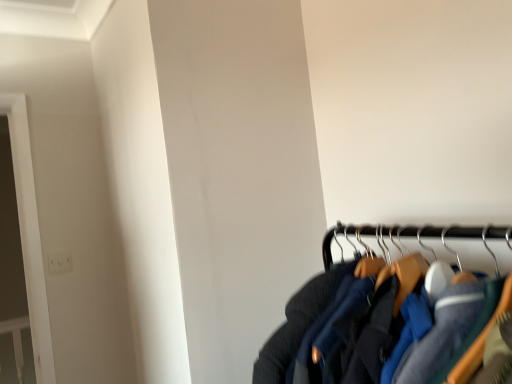
This screenshot has width=512, height=384. What do you see at coordinates (60, 262) in the screenshot?
I see `white plastic electric outlet at upper left` at bounding box center [60, 262].

I want to click on white plastic electric outlet at upper left, so click(60, 262).

What is the approximate width of dark blue fabric jacket at lower right?

It is 26.81 inches.

Locate an element on the screen. dark blue fabric jacket at lower right is located at coordinates (300, 313).

The image size is (512, 384). Describe the element at coordinates (300, 313) in the screenshot. I see `dark blue fabric jacket at lower right` at that location.

At what (x,y) coordinates should I click in order to perform the action: click on white plastic electric outlet at upper left. Please return your answer as a coordinate pair (x, y). The width and height of the screenshot is (512, 384). Looking at the image, I should click on (60, 262).

Can you confirm if dark blue fabric jacket at lower right is positioned to the left of white plastic electric outlet at upper left?

No, dark blue fabric jacket at lower right is not to the left of white plastic electric outlet at upper left.

In the image, is dark blue fabric jacket at lower right positioned in front of or behind white plastic electric outlet at upper left?

Visually, dark blue fabric jacket at lower right is located in front of white plastic electric outlet at upper left.

Is point (312, 314) more distant than point (49, 253)?

No.

Consider the image. From the image's perspective, is dark blue fabric jacket at lower right on white plastic electric outlet at upper left?

Yes, from the image's perspective, dark blue fabric jacket at lower right is over white plastic electric outlet at upper left.

From a real-world perspective, relative to white plastic electric outlet at upper left, is dark blue fabric jacket at lower right vertically above or below?

From a real-world perspective, dark blue fabric jacket at lower right is physically below white plastic electric outlet at upper left.

Considering the sizes of objects dark blue fabric jacket at lower right and white plastic electric outlet at upper left in the image provided, who is wider, dark blue fabric jacket at lower right or white plastic electric outlet at upper left?

dark blue fabric jacket at lower right is wider.

In terms of height, does dark blue fabric jacket at lower right look taller or shorter compared to white plastic electric outlet at upper left?

dark blue fabric jacket at lower right is taller than white plastic electric outlet at upper left.

Consider the image. Is dark blue fabric jacket at lower right bigger than white plastic electric outlet at upper left?

Yes, dark blue fabric jacket at lower right is bigger than white plastic electric outlet at upper left.

Is dark blue fabric jacket at lower right positioned beyond the bounds of white plastic electric outlet at upper left?

That's correct, dark blue fabric jacket at lower right is outside of white plastic electric outlet at upper left.

Would you consider dark blue fabric jacket at lower right to be distant from white plastic electric outlet at upper left?

Yes, dark blue fabric jacket at lower right is far from white plastic electric outlet at upper left.

Is dark blue fabric jacket at lower right looking in the opposite direction of white plastic electric outlet at upper left?

No, dark blue fabric jacket at lower right's orientation is not away from white plastic electric outlet at upper left.

This screenshot has width=512, height=384. Find the location of `electric outlet lying behind the dark blue fabric jacket at lower right`. electric outlet lying behind the dark blue fabric jacket at lower right is located at coordinates pyautogui.click(x=60, y=262).

In the scene shown: Considering the relative positions of white plastic electric outlet at upper left and dark blue fabric jacket at lower right in the image provided, is white plastic electric outlet at upper left to the right of dark blue fabric jacket at lower right from the viewer's perspective?

No.

From the picture: Is white plastic electric outlet at upper left positioned before dark blue fabric jacket at lower right?

No, the depth of white plastic electric outlet at upper left is greater than that of dark blue fabric jacket at lower right.

Which point is more distant from viewer, [54,253] or [280,359]?

The point [54,253] is more distant.

From the image's perspective, would you say white plastic electric outlet at upper left is positioned over dark blue fabric jacket at lower right?

No, from the image's perspective, white plastic electric outlet at upper left is not on top of dark blue fabric jacket at lower right.

From a real-world perspective, who is located higher, white plastic electric outlet at upper left or dark blue fabric jacket at lower right?

white plastic electric outlet at upper left is physically above.

Which object is wider, white plastic electric outlet at upper left or dark blue fabric jacket at lower right?

With larger width is dark blue fabric jacket at lower right.

Who is taller, white plastic electric outlet at upper left or dark blue fabric jacket at lower right?

With more height is dark blue fabric jacket at lower right.

Considering the sizes of objects white plastic electric outlet at upper left and dark blue fabric jacket at lower right in the image provided, who is smaller, white plastic electric outlet at upper left or dark blue fabric jacket at lower right?

white plastic electric outlet at upper left.

Do you think white plastic electric outlet at upper left is within dark blue fabric jacket at lower right, or outside of it?

The correct answer is: outside.

Is white plastic electric outlet at upper left next to dark blue fabric jacket at lower right?

They are not placed beside each other.

Is white plastic electric outlet at upper left facing towards dark blue fabric jacket at lower right?

Yes, white plastic electric outlet at upper left is oriented towards dark blue fabric jacket at lower right.

How many degrees apart are the facing directions of white plastic electric outlet at upper left and dark blue fabric jacket at lower right?

They differ by 89.8 degrees in their facing directions.

Identify the location of electric outlet behind the dark blue fabric jacket at lower right. (60, 262).

Where is `jacket that is above the white plastic electric outlet at upper left (from the image's perspective)`? Image resolution: width=512 pixels, height=384 pixels. jacket that is above the white plastic electric outlet at upper left (from the image's perspective) is located at coordinates (300, 313).

Locate an element on the screen. This screenshot has height=384, width=512. electric outlet on the left of the dark blue fabric jacket at lower right is located at coordinates (60, 262).